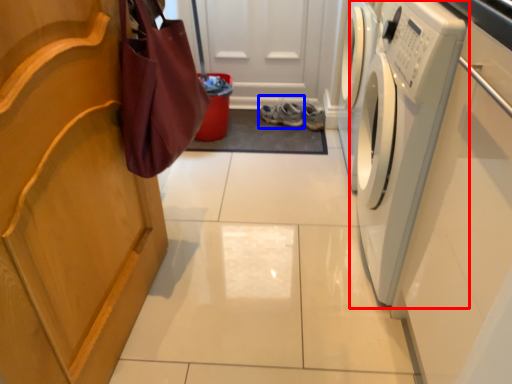
Question: Which object appears farthest to the camera in this image, washing machine (highlighted by a red box) or footwear (highlighted by a blue box)?

Choices:
 (A) washing machine
 (B) footwear

Answer: (B)